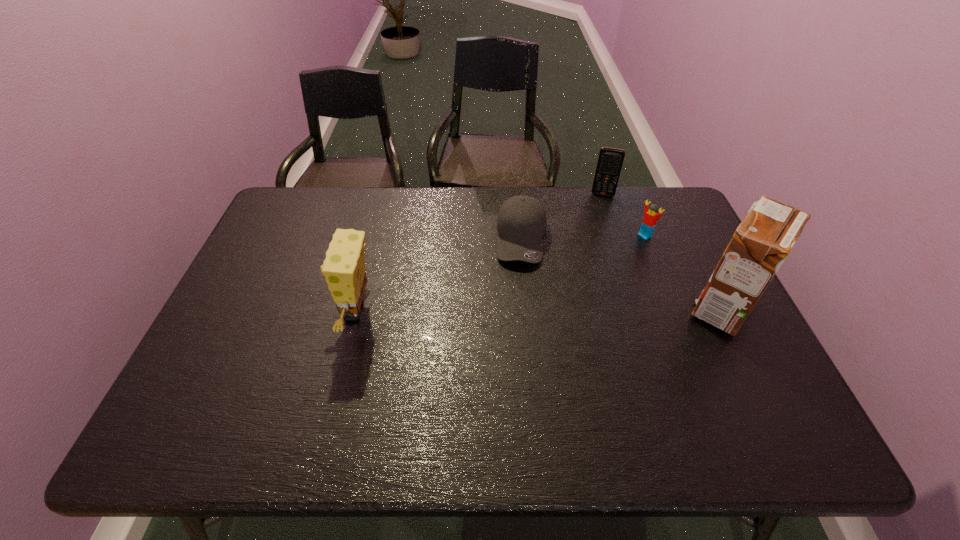
At what (x,y) coordinates should I click in order to perform the action: click on free point located 0.050m on the face of the leftmost object. Please return your answer as a coordinate pair (x, y). This screenshot has width=960, height=540. Looking at the image, I should click on (317, 312).

Find the location of a particular element. free location located on the straw side of the rightmost object is located at coordinates (641, 308).

The height and width of the screenshot is (540, 960). What are the coordinates of `free location located on the straw side of the rightmost object` in the screenshot? It's located at [601, 308].

Where is `vacant space located on the straw side of the rightmost object`? This screenshot has height=540, width=960. vacant space located on the straw side of the rightmost object is located at coordinates (604, 308).

Find the location of `vacant region located 0.250m on the front brim of the second object from left to right`. vacant region located 0.250m on the front brim of the second object from left to right is located at coordinates (523, 338).

Where is `free space located 0.120m on the front brim of the second object from left to right`? free space located 0.120m on the front brim of the second object from left to right is located at coordinates (523, 299).

This screenshot has width=960, height=540. What are the coordinates of `free space located on the front brim of the second object from left to right` in the screenshot? It's located at (523, 372).

Where is `free space located 0.130m on the face of the Lego`? free space located 0.130m on the face of the Lego is located at coordinates [612, 256].

Locate an element on the screen. Image resolution: width=960 pixels, height=540 pixels. free space located on the face of the Lego is located at coordinates (603, 262).

Identify the location of vacant space located 0.390m on the face of the Lego. (549, 295).